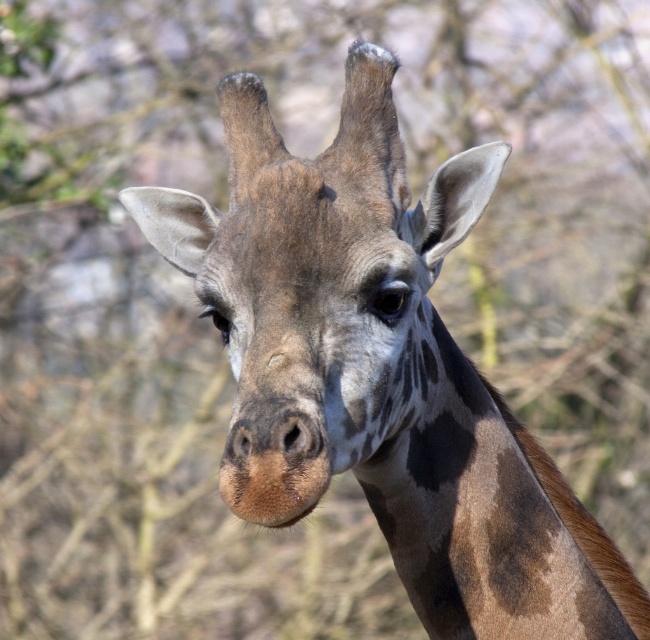
Question: Among these objects, which one is farthest from the camera?

Choices:
 (A) brown spotted fur at center
 (B) brown spotted neck at center

Answer: (B)

Question: Which point is closer to the camera?

Choices:
 (A) pyautogui.click(x=287, y=413)
 (B) pyautogui.click(x=382, y=499)

Answer: (A)

Question: Among these objects, which one is farthest from the camera?

Choices:
 (A) brown spotted neck at center
 (B) brown spotted fur at center

Answer: (A)

Question: Is brown spotted fur at center thinner than brown spotted neck at center?

Choices:
 (A) no
 (B) yes

Answer: (A)

Question: Does brown spotted fur at center appear on the right side of brown spotted neck at center?

Choices:
 (A) yes
 (B) no

Answer: (B)

Question: Is brown spotted fur at center above brown spotted neck at center?

Choices:
 (A) no
 (B) yes

Answer: (B)